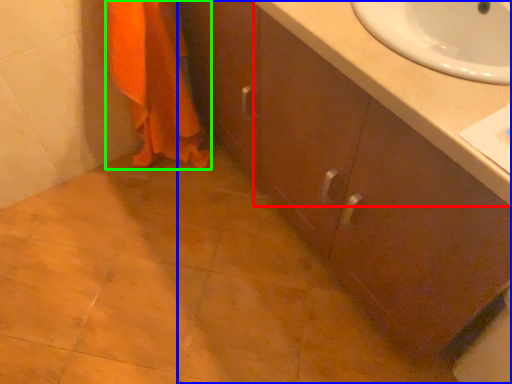
Question: Which is nearer to the counter top (highlighted by a red box)? bathroom cabinet (highlighted by a blue box) or bath towel (highlighted by a green box).

Choices:
 (A) bathroom cabinet
 (B) bath towel

Answer: (A)